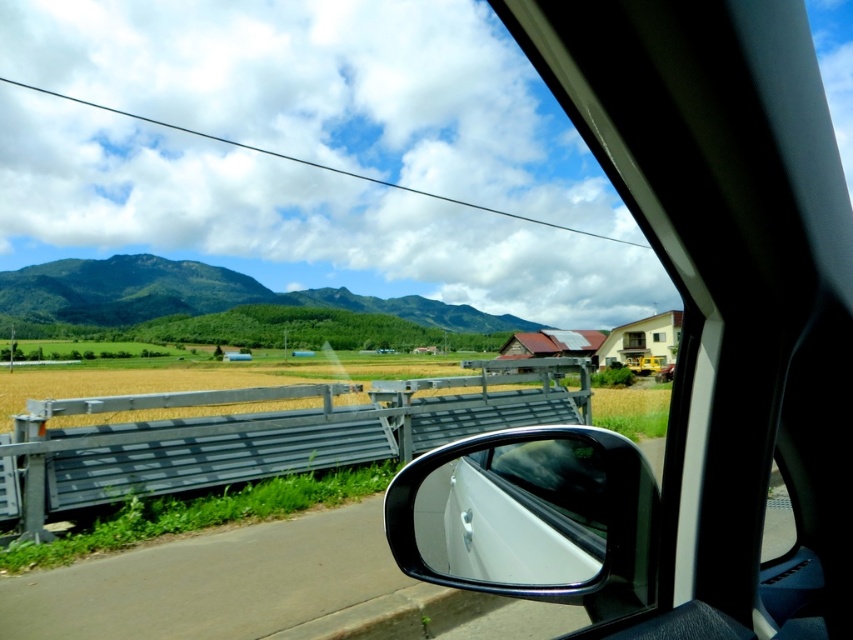
You are a passenger in the car and looking through the window. You notice the black glossy side mirror at center and the green forested mountain at left. Which object takes up more space in your view?

The green forested mountain at left takes up more space in your view because it occupies more area than the black glossy side mirror at center according to the description.

Looking at this image, you are sitting in the passenger seat of the car and looking out the window. You see the black glossy side mirror at center and the green forested mountain at left. Which object is closer to you?

The black glossy side mirror at center is closer to you because it is positioned in front of the green forested mountain at left, indicating it is nearer in the line of sight.